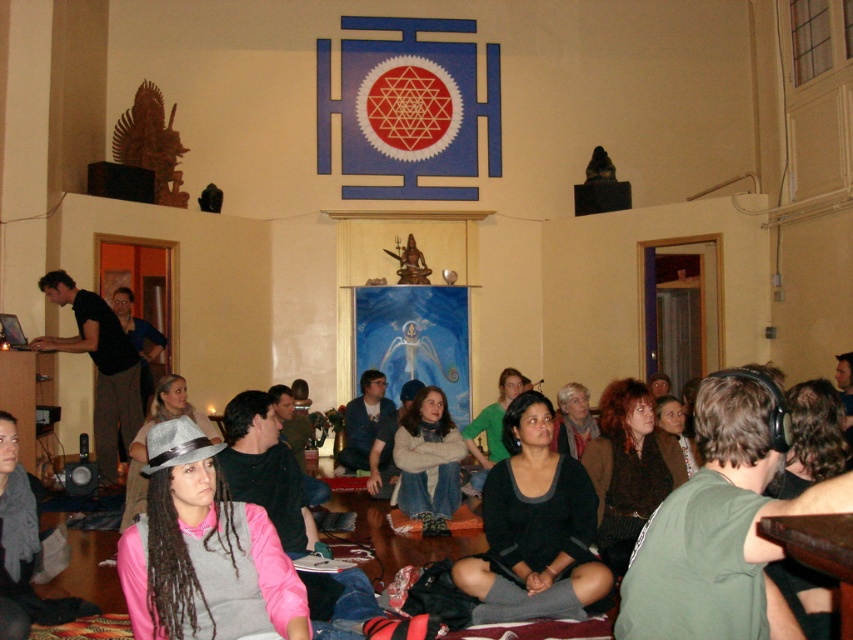
Question: From the image, what is the correct spatial relationship of black matte sweater at center in relation to black shirt at left?

Choices:
 (A) left
 (B) right

Answer: (B)

Question: Does black matte sweater at center come in front of black shirt at left?

Choices:
 (A) no
 (B) yes

Answer: (B)

Question: In this image, where is black matte sweater at center located relative to black shirt at left?

Choices:
 (A) above
 (B) below

Answer: (B)

Question: Which point is farther to the camera?

Choices:
 (A) (525, 442)
 (B) (67, 342)

Answer: (B)

Question: Which of the following is the farthest from the observer?

Choices:
 (A) black shirt at left
 (B) black matte sweater at center

Answer: (A)